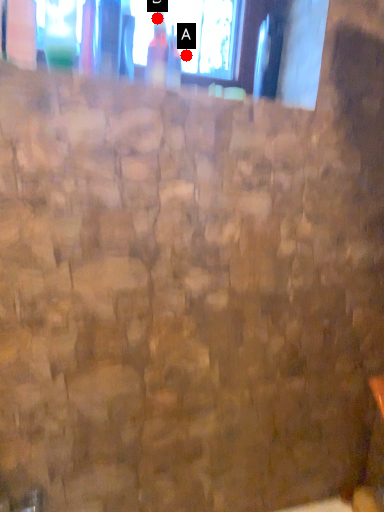
Question: Two points are circled on the image, labeled by A and B beside each circle. Which point is closer to the camera?

Choices:
 (A) A is closer
 (B) B is closer

Answer: (B)